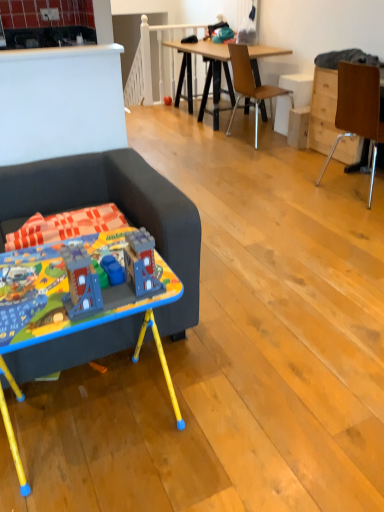
At what (x,y) coordinates should I click in order to perform the action: click on free region under brown wooden chair at center, positioned as the 2th chair in front-to-back order (from a real-world perspective). Please return your answer as a coordinate pair (x, y). Looking at the image, I should click on (242, 136).